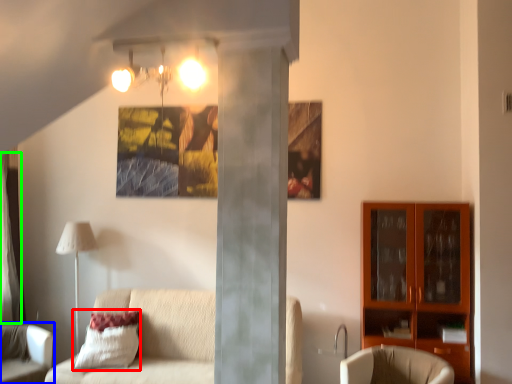
Question: Based on their relative distances, which object is farther from pillow (highlighted by a red box)? Choose from chair (highlighted by a blue box) and curtain (highlighted by a green box).

Choices:
 (A) chair
 (B) curtain

Answer: (B)